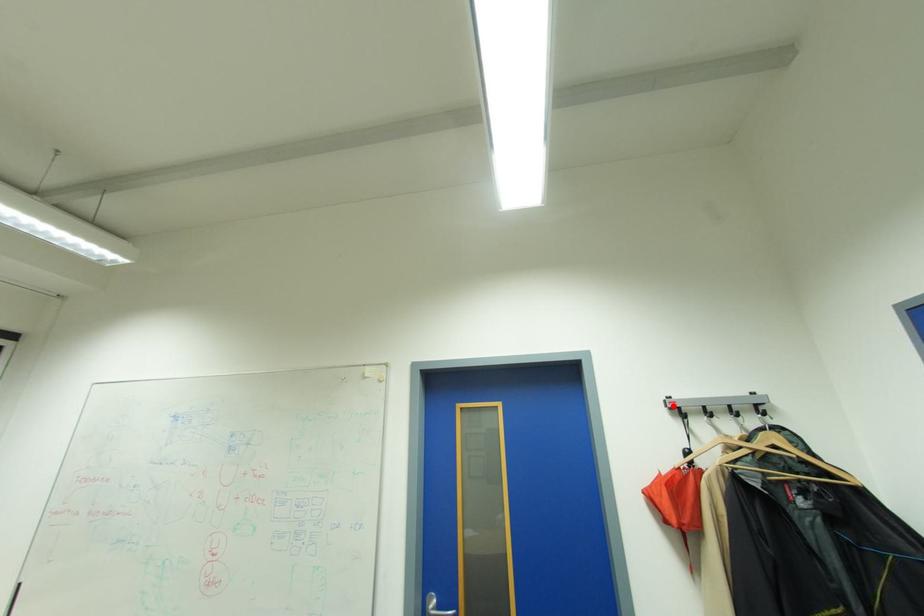
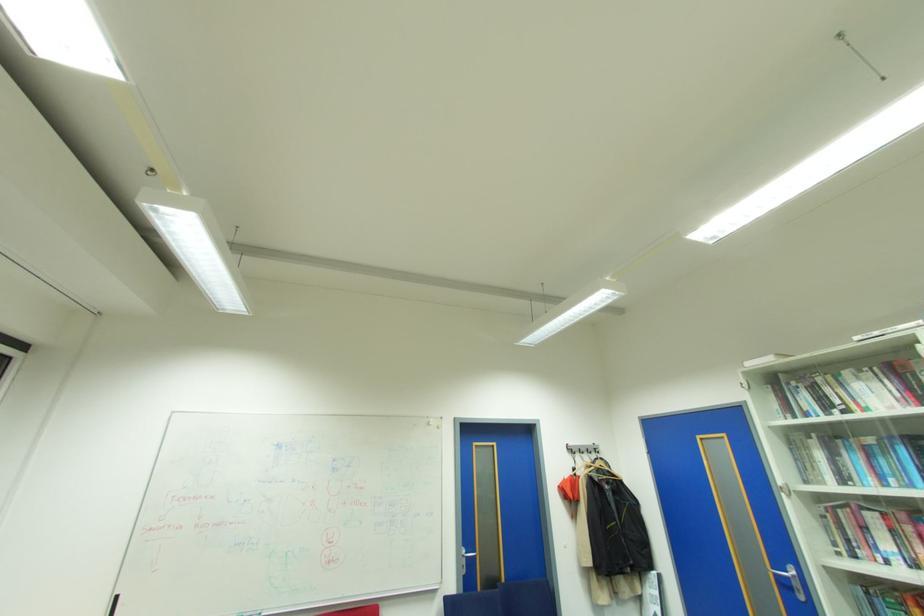
Locate, in the second image, the point that corresponds to the highlighted location in the first image.

(573, 448)